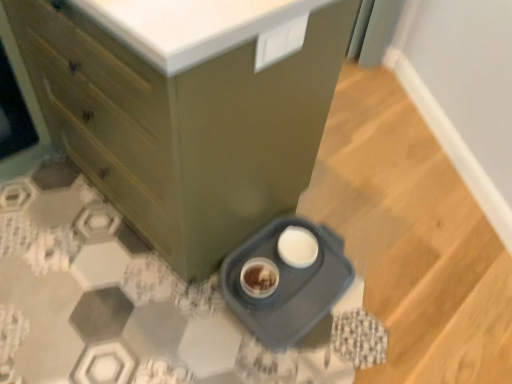
Identify the location of vacant space to the right of gray plastic tray at lower center. (404, 292).